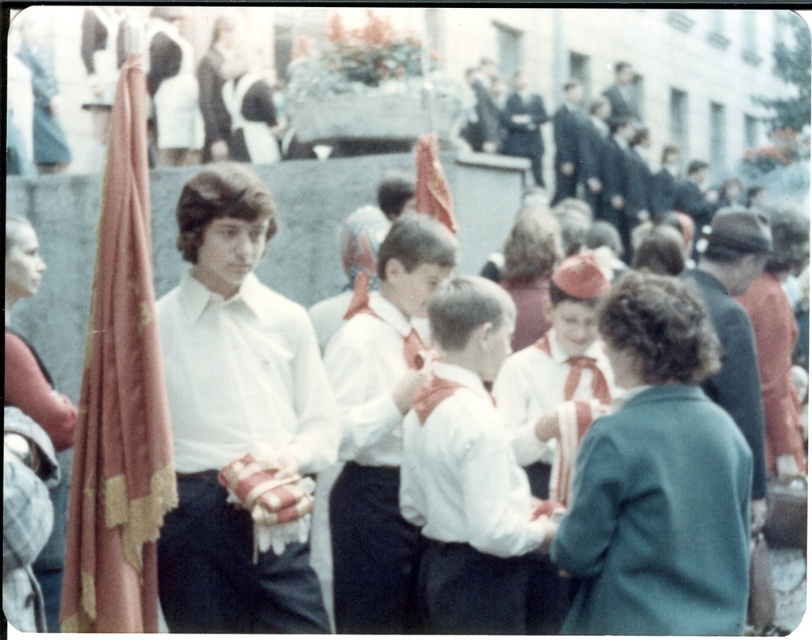
Does white cotton shirt at center have a greater width compared to green wool coat at center?

No, white cotton shirt at center is not wider than green wool coat at center.

Which is in front, point (365, 577) or point (759, 429)?

Positioned in front is point (365, 577).

Which is behind, point (350, 416) or point (758, 509)?

Point (758, 509)

Where is `white cotton shirt at center`? Image resolution: width=812 pixels, height=640 pixels. white cotton shirt at center is located at coordinates (370, 465).

Is point (279, 326) positioned after point (749, 333)?

That is False.

Does white satin shirt at center have a lesser height compared to green wool coat at center?

Yes.

This screenshot has height=640, width=812. What do you see at coordinates (243, 378) in the screenshot?
I see `white satin shirt at center` at bounding box center [243, 378].

I want to click on white satin shirt at center, so click(x=243, y=378).

Does white satin bow tie at center appear on the left side of white cotton shirt at center?

No, white satin bow tie at center is not to the left of white cotton shirt at center.

Is point (474, 570) in front of point (352, 548)?

Yes.

At what (x,y) coordinates should I click in order to perform the action: click on white satin bow tie at center. Please return your answer as a coordinate pair (x, y). This screenshot has height=640, width=812. Looking at the image, I should click on (469, 472).